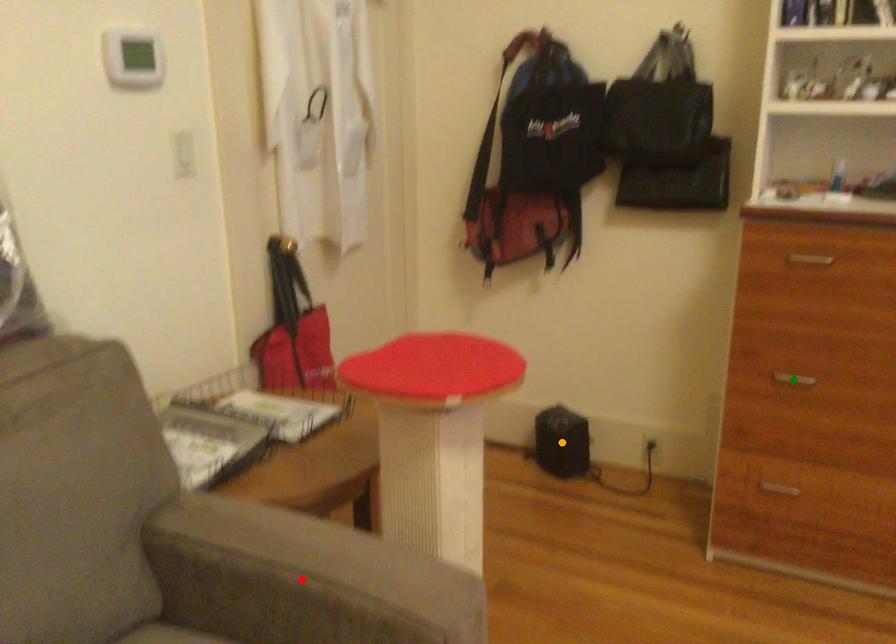
Order these from nearest to farthest:
1. green point
2. red point
3. orange point

red point < green point < orange point